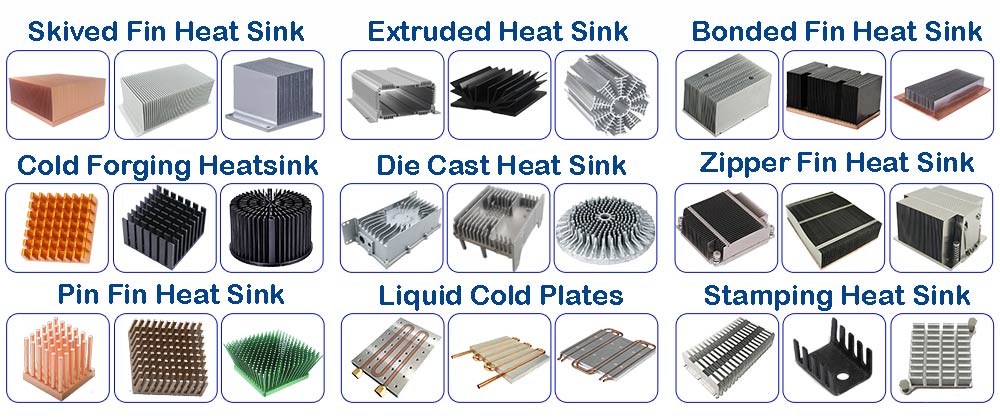
You are a GUI agent. You are given a task and a screenshot of the screen. Output one action in this format:
    pyautogui.click(x=<x>, y=<y>)
    Task: Click on the electrical plate
    
    Given the screenshot: What is the action you would take?
    pyautogui.click(x=622, y=228), pyautogui.click(x=392, y=355)